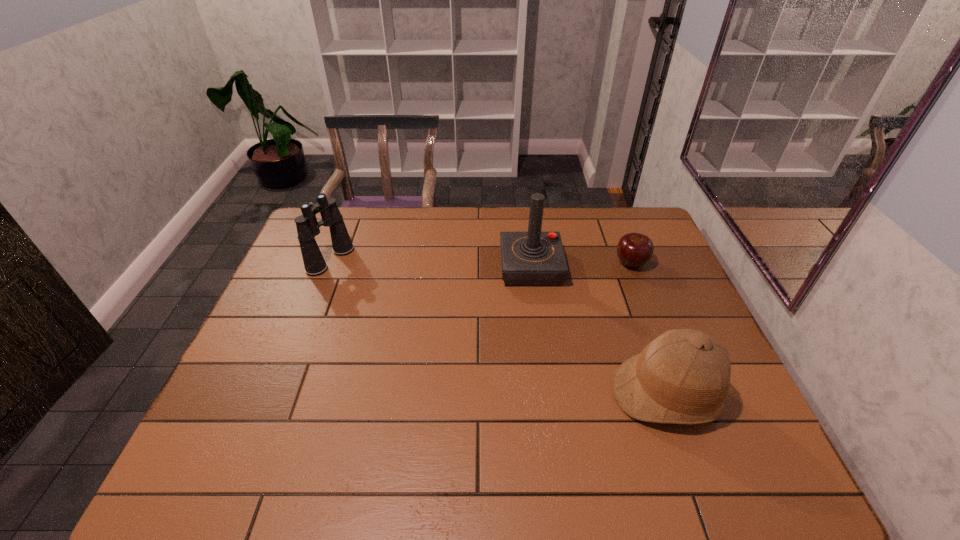
Locate an element on the screen. This screenshot has height=540, width=960. object positioned at the far edge is located at coordinates (307, 226).

At what (x,y) coordinates should I click in order to perform the action: click on object that is at the left edge. Please return your answer as a coordinate pair (x, y). Image resolution: width=960 pixels, height=540 pixels. Looking at the image, I should click on (307, 226).

This screenshot has width=960, height=540. What are the coordinates of `hat at the right edge` in the screenshot? It's located at (683, 376).

In order to click on apple that is at the right edge in this screenshot , I will do `click(634, 250)`.

What are the coordinates of `object situated at the far left corner` in the screenshot? It's located at (307, 226).

Where is `free region at the far edge`? This screenshot has width=960, height=540. free region at the far edge is located at coordinates click(524, 207).

This screenshot has width=960, height=540. Identify the location of free space at the near edge. (590, 469).

In the image, there is a desktop. Identify the location of vacant space at the left edge. The width and height of the screenshot is (960, 540). (310, 325).

You are a GUI agent. You are given a task and a screenshot of the screen. Output one action in this format:
    pyautogui.click(x=<x>, y=<y>)
    Task: Click on the free spot at the right edge of the desktop
    Image resolution: width=960 pixels, height=540 pixels.
    Given the screenshot: What is the action you would take?
    pyautogui.click(x=643, y=284)

The width and height of the screenshot is (960, 540). I want to click on vacant area that lies between the shortest object and the nearest object, so click(x=649, y=329).